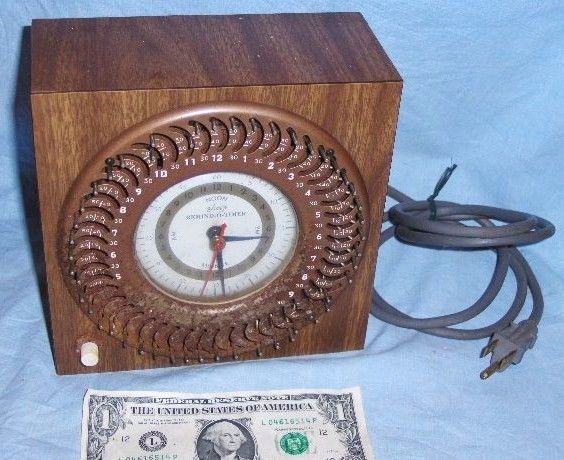
This screenshot has height=460, width=564. Identify the location of wooden case. (142, 69).